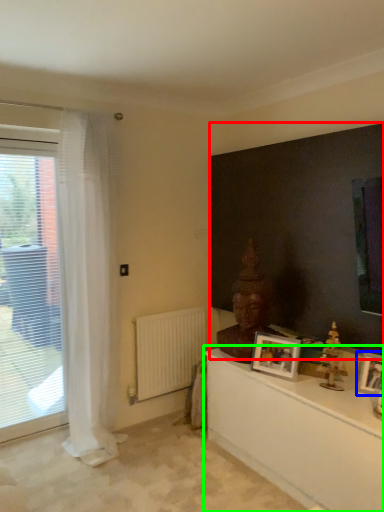
Question: Which object is positioned farthest from backdrop (highlighted by a red box)? Select from picture frame (highlighted by a blue box) and table (highlighted by a green box).

Choices:
 (A) picture frame
 (B) table

Answer: (B)